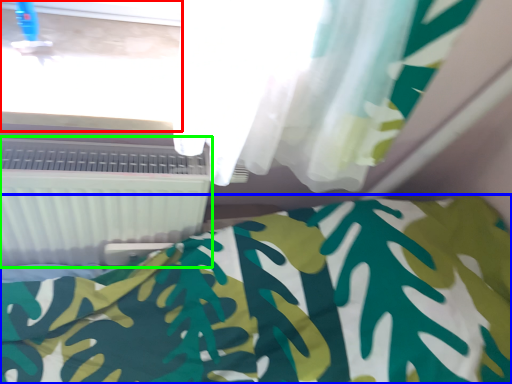
Question: Which is nearer to the window frame (highlighted by a red box)? bed (highlighted by a blue box) or air conditioning (highlighted by a green box).

Choices:
 (A) bed
 (B) air conditioning

Answer: (B)